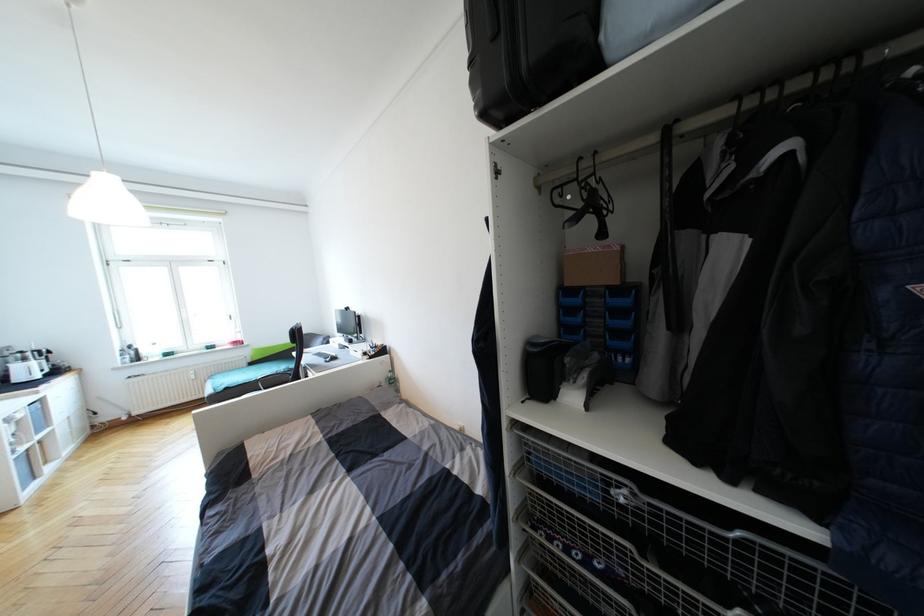
The width and height of the screenshot is (924, 616). What do you see at coordinates (528, 54) in the screenshot? I see `the black suitcase` at bounding box center [528, 54].